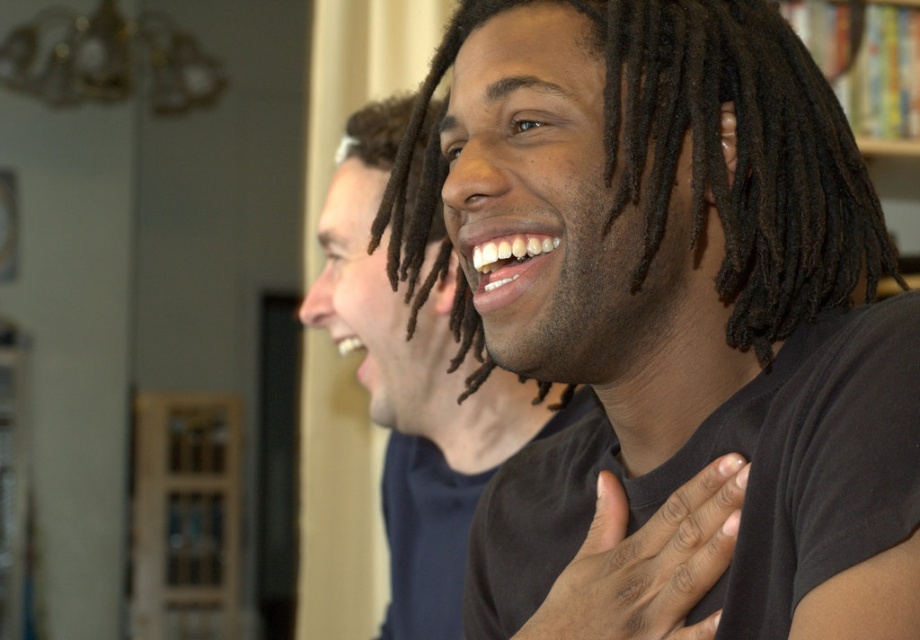
Question: Which of the following is the farthest from the observer?

Choices:
 (A) (502, 426)
 (B) (589, 600)
 (C) (765, 268)

Answer: (A)

Question: Does dark brown dreadlocks at center have a greater width compared to black matte t-shirt at center?

Choices:
 (A) yes
 (B) no

Answer: (A)

Question: Which object is the farthest from the black matte t-shirt at center?

Choices:
 (A) black matte hand at center
 (B) dark brown dreadlocks at center

Answer: (A)

Question: Which of the following is the farthest from the observer?

Choices:
 (A) (397, 515)
 (B) (618, 515)
 (C) (487, 6)

Answer: (A)

Question: Does dark brown dreadlocks at center appear on the right side of black matte hand at center?

Choices:
 (A) yes
 (B) no

Answer: (B)

Question: Observing the image, what is the correct spatial positioning of black matte t-shirt at center in reference to black matte hand at center?

Choices:
 (A) left
 (B) right

Answer: (A)